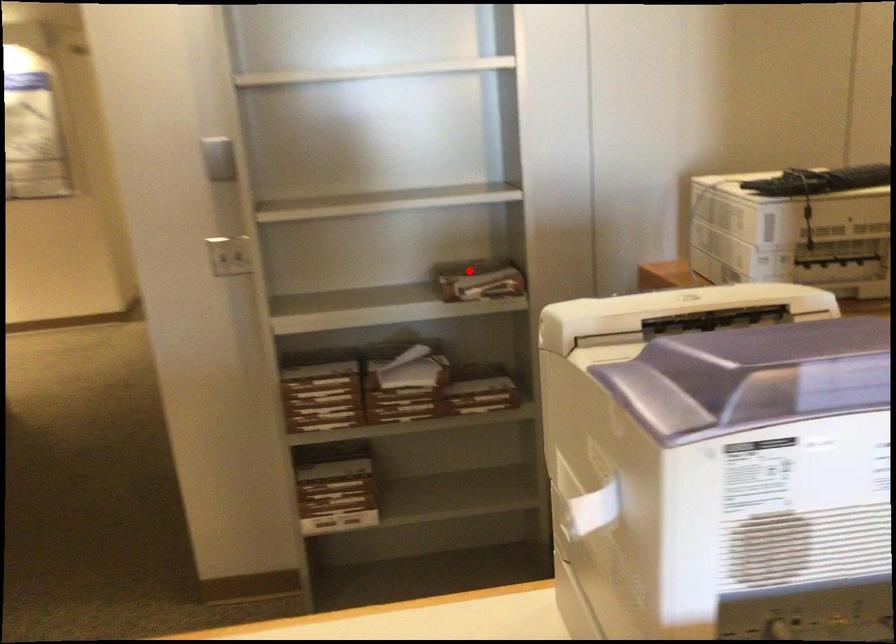
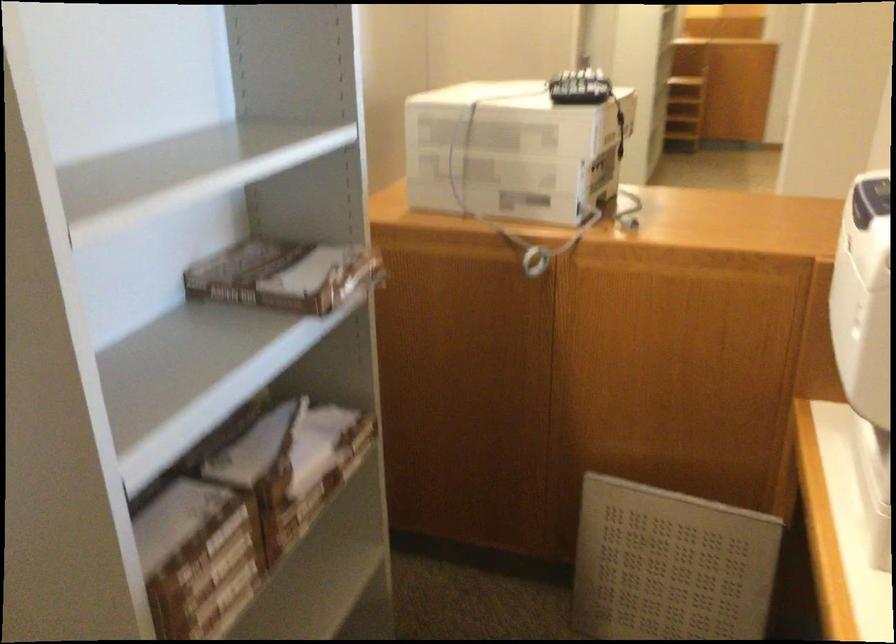
Question: I am providing you with two images of the same scene from different viewpoints. Given a red point in image1, look at the same physical point in image2. Is it:

Choices:
 (A) Closer to the viewpoint
 (B) Farther from the viewpoint

Answer: (A)